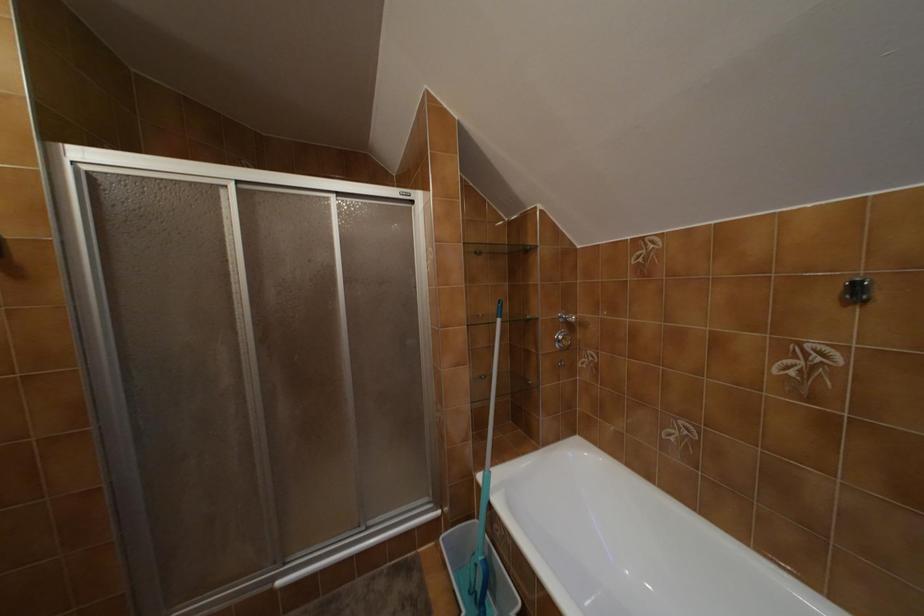
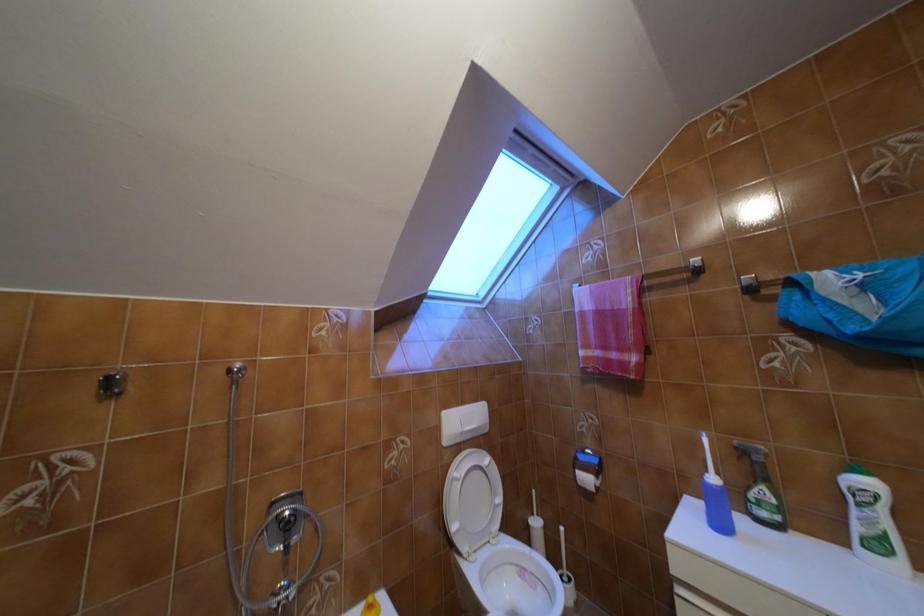
Question: The camera is either moving clockwise (left) or counter-clockwise (right) around the object. The first image is from the beginning of the video and the second image is from the end. Is the camera moving left or right when shooting the video?

Choices:
 (A) Left
 (B) Right

Answer: (A)